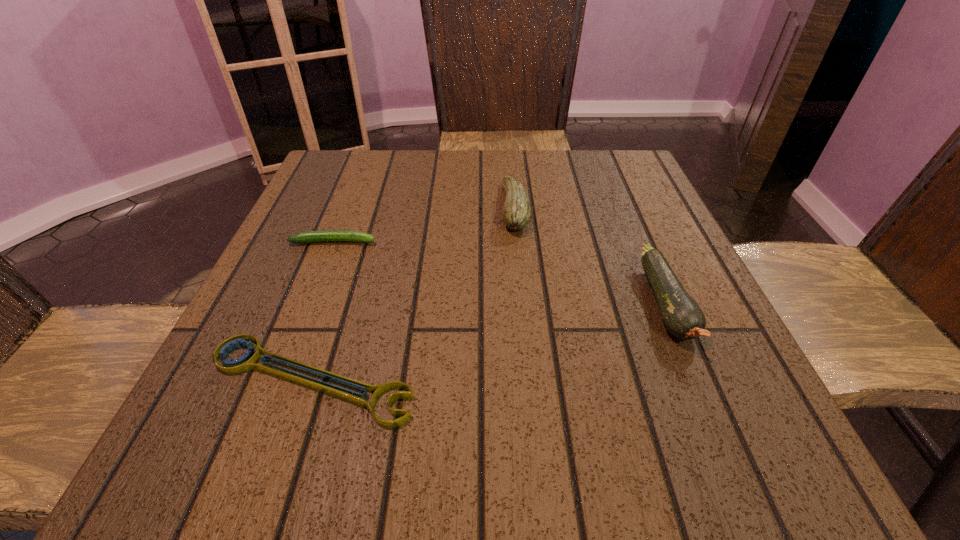
Locate an element on the screen. The image size is (960, 540). vacant space located 0.260m at the stem end of the farthest object is located at coordinates (382, 208).

Identify the location of vacant space located on the front-facing side of the leftmost zucchini. The image size is (960, 540). (507, 241).

Find the location of a particular element. Image resolution: width=960 pixels, height=540 pixels. free space located 0.360m on the right of the shortest object is located at coordinates (664, 380).

Where is `object that is at the far edge`? This screenshot has width=960, height=540. object that is at the far edge is located at coordinates (516, 214).

Find the location of a particular element. Image resolution: width=960 pixels, height=540 pixels. object positioned at the near edge is located at coordinates (248, 361).

At what (x,y) coordinates should I click in order to perform the action: click on zucchini that is at the left edge. Please return your answer as a coordinate pair (x, y). Looking at the image, I should click on (329, 235).

I want to click on wrench that is at the left edge, so click(248, 361).

Where is `object that is positioned at the right edge`? object that is positioned at the right edge is located at coordinates (682, 316).

Identify the location of object that is at the near left corner. (248, 361).

Locate an element on the screen. vacant point at the far edge is located at coordinates (464, 158).